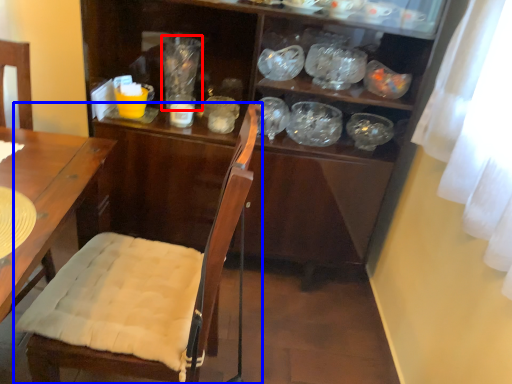
Question: Which of the following is the closest to the observer, glass jar (highlighted by a red box) or chair (highlighted by a blue box)?

Choices:
 (A) glass jar
 (B) chair

Answer: (B)